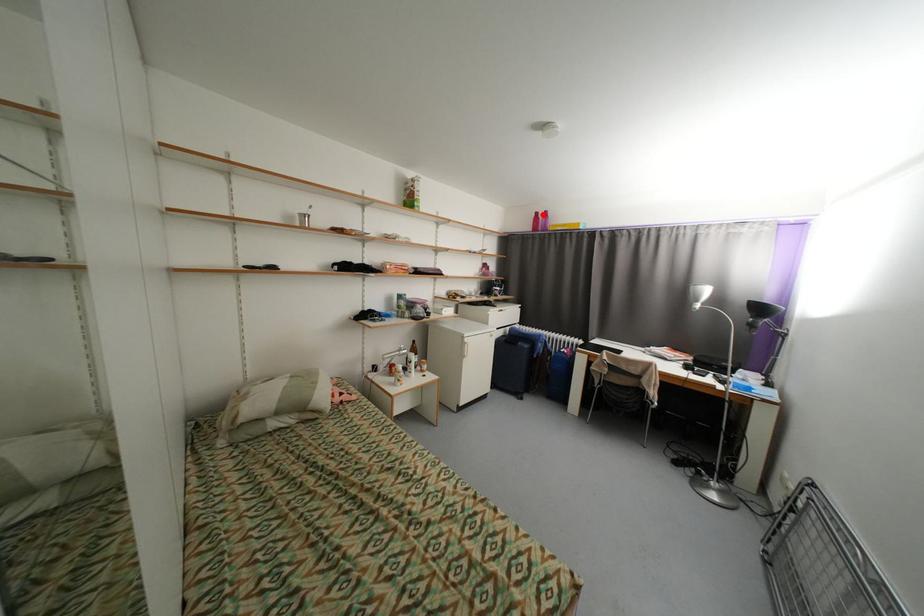
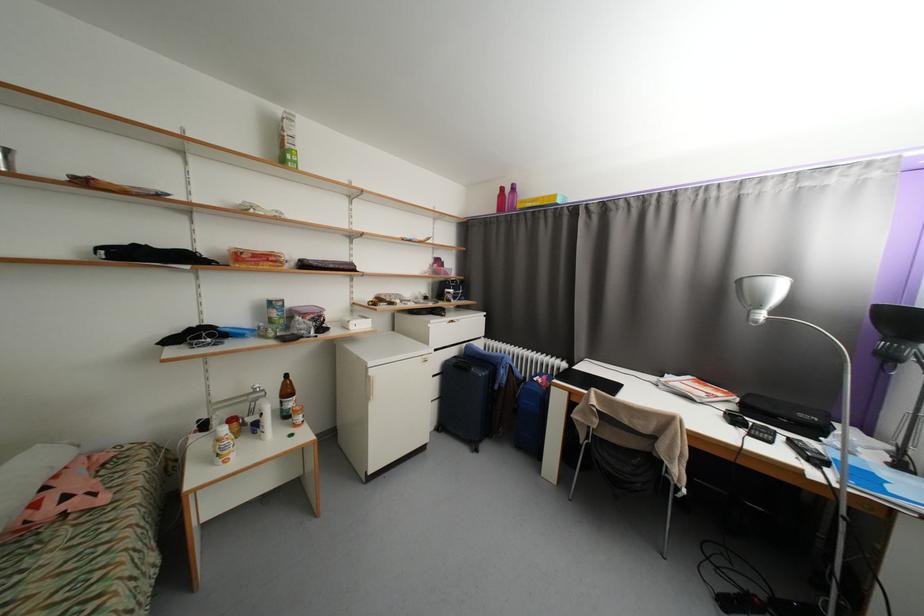
Find the pixel in the second image that matches the highlighted location in the first image.

(508, 190)